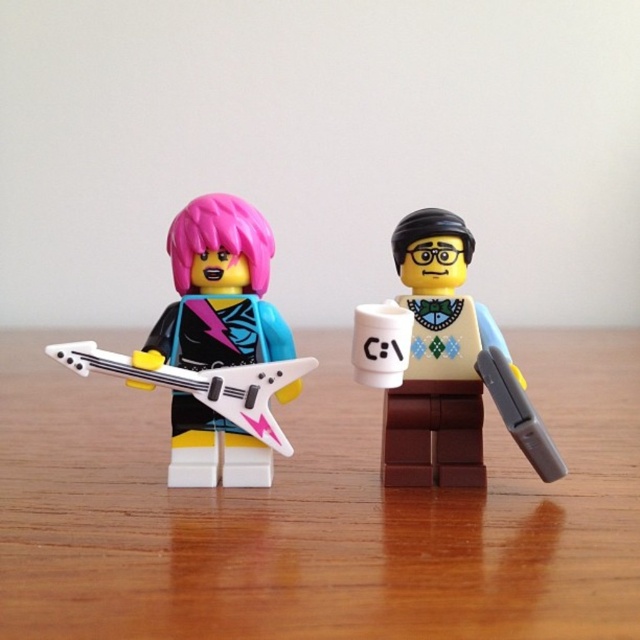
You are organizing items on a desk and need to place a new item between the matte brown briefcase at right and the white plastic guitar at left. Based on their positions, which item is closer to the front of the desk?

The matte brown briefcase at right is closer to the front of the desk because it is positioned in front of the white plastic guitar at left.

You are a delivery robot that needs to place a package between the wooden table at center and the matte brown briefcase at right. The package is 10 inches wide. Can you fit it in the space between them without moving either object?

The distance between the wooden table at center and the matte brown briefcase at right is 12.55 inches. Since the package is 10 inches wide, it can fit in the space between them without moving either object.